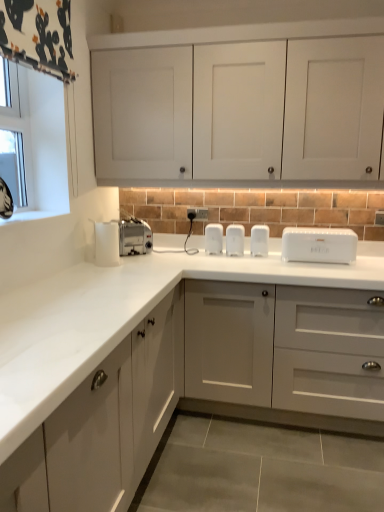
What is the approximate height of matte white cabinet at center, which appears as the first cabinetry when ordered from the bottom?

It is 36.23 inches.

Describe the element at coordinates (286, 349) in the screenshot. The image size is (384, 512). I see `matte white cabinet at center, which appears as the first cabinetry when ordered from the bottom` at that location.

Identify the location of white plastic electric outlet at center. This screenshot has width=384, height=512. (197, 214).

You are a GUI agent. You are given a task and a screenshot of the screen. Output one action in this format:
    pyautogui.click(x=<x>, y=<y>)
    Task: Click on the white matte cabinet doors at upper center, positioned as the 2th cabinetry in bottom-to-top order
    This screenshot has width=384, height=512.
    Given the screenshot: What is the action you would take?
    pyautogui.click(x=238, y=34)

The image size is (384, 512). I want to click on white plastic toaster at center, arranged as the 3th appliance when viewed from the left, so click(235, 240).

What are the coordinates of `matte white cabinet at center, which appears as the first cabinetry when ordered from the bottom` in the screenshot? It's located at (286, 349).

Is point (125, 233) closer to viewer compared to point (253, 250)?

No, (125, 233) is behind (253, 250).

From the picture: How different are the orientations of satin silver toaster at left, which is the 1th appliance in left-to-right order, and white plastic toaster at center, the 4th appliance from the left, in degrees?

86.1 degrees separate the facing orientations of satin silver toaster at left, which is the 1th appliance in left-to-right order, and white plastic toaster at center, the 4th appliance from the left.

Image resolution: width=384 pixels, height=512 pixels. I want to click on appliance that is in front of the white plastic toaster at center, which is the 1th appliance from right to left, so click(133, 234).

Is satin silver toaster at left, which appears as the 4th appliance when viewed from the right, not within white plastic toaster at center, which is the 1th appliance from right to left?

That's correct, satin silver toaster at left, which appears as the 4th appliance when viewed from the right, is outside of white plastic toaster at center, which is the 1th appliance from right to left.

The width and height of the screenshot is (384, 512). I want to click on window sill to the left of silver metallic toaster at center, so click(30, 216).

Between point (22, 213) and point (140, 245), which one is positioned behind?

Point (140, 245)

Between white glossy window sill at upper left and silver metallic toaster at center, which one is positioned behind?

Answer: silver metallic toaster at center.

Do you think white glossy window sill at upper left is within silver metallic toaster at center, or outside of it?

The correct answer is: outside.

Identify the location of window sill above the white plastic toaster at center, which is the 1th appliance from right to left (from the image's perspective). The height and width of the screenshot is (512, 384). (30, 216).

From the image's perspective, relative to white glossy window sill at upper left, is white plastic toaster at center, the 4th appliance from the left, above or below?

Clearly, from the image's perspective, white plastic toaster at center, the 4th appliance from the left, is below white glossy window sill at upper left.

Which of these two, white plastic toaster at center, the 4th appliance from the left, or white glossy window sill at upper left, stands shorter?

Standing shorter between the two is white glossy window sill at upper left.

Is white plastic toaster at center, the 4th appliance from the left, turned away from white glossy window sill at upper left?

No, white plastic toaster at center, the 4th appliance from the left,'s orientation is not away from white glossy window sill at upper left.

Which object is positioned more to the right, silver metallic toaster at center or white plastic toaster at center, which is counted as the 2th appliance, starting from the right?

white plastic toaster at center, which is counted as the 2th appliance, starting from the right, is more to the right.

Are silver metallic toaster at center and white plastic toaster at center, arranged as the 3th appliance when viewed from the left, located far from each other?

Actually, silver metallic toaster at center and white plastic toaster at center, arranged as the 3th appliance when viewed from the left, are a little close together.

From the image's perspective, who appears lower, silver metallic toaster at center or white plastic toaster at center, which is counted as the 2th appliance, starting from the right?

white plastic toaster at center, which is counted as the 2th appliance, starting from the right, from the image's perspective.

From a real-world perspective, does silver metallic toaster at center stand above white plastic toaster at center, arranged as the 3th appliance when viewed from the left?

Yes, from a real-world perspective, silver metallic toaster at center is on top of white plastic toaster at center, arranged as the 3th appliance when viewed from the left.

Measure the distance from silver metallic toaster at center to white glossy window sill at upper left.

A distance of 53.25 centimeters exists between silver metallic toaster at center and white glossy window sill at upper left.

Between silver metallic toaster at center and white glossy window sill at upper left, which one has smaller size?

With smaller size is white glossy window sill at upper left.

From a real-world perspective, which is physically below, silver metallic toaster at center or white glossy window sill at upper left?

silver metallic toaster at center, from a real-world perspective.

Is silver metallic toaster at center facing away from white plastic bread bin at center?

silver metallic toaster at center is not turned away from white plastic bread bin at center.

Does silver metallic toaster at center have a greater height compared to white plastic bread bin at center?

Yes.

Which object is thinner, silver metallic toaster at center or white plastic bread bin at center?

silver metallic toaster at center is thinner.

Is silver metallic toaster at center with white plastic bread bin at center?

silver metallic toaster at center and white plastic bread bin at center are clearly separated.

From the image's perspective, relative to white plastic toaster at center, which is the 1th appliance from right to left, is white matte cabinet doors at upper center, marked as the 1th cabinetry in a top-to-bottom arrangement, above or below?

white matte cabinet doors at upper center, marked as the 1th cabinetry in a top-to-bottom arrangement, is above white plastic toaster at center, which is the 1th appliance from right to left.

Considering the relative sizes of white matte cabinet doors at upper center, marked as the 1th cabinetry in a top-to-bottom arrangement, and white plastic toaster at center, which is the 1th appliance from right to left, in the image provided, is white matte cabinet doors at upper center, marked as the 1th cabinetry in a top-to-bottom arrangement, taller than white plastic toaster at center, which is the 1th appliance from right to left,?

Indeed, white matte cabinet doors at upper center, marked as the 1th cabinetry in a top-to-bottom arrangement, has a greater height compared to white plastic toaster at center, which is the 1th appliance from right to left.

Is white matte cabinet doors at upper center, positioned as the 2th cabinetry in bottom-to-top order, turned away from white plastic toaster at center, which is the 1th appliance from right to left?

No.

Starting from the satin silver toaster at left, which appears as the 4th appliance when viewed from the right, which appliance is the 1st one behind? Please provide its 2D coordinates.

[(259, 240)]

Where is `toaster beneath the white glossy window sill at upper left (from a real-world perspective)`? This screenshot has width=384, height=512. toaster beneath the white glossy window sill at upper left (from a real-world perspective) is located at coordinates (134, 237).

Which object lies nearer to the anchor point silver metallic toaster at center, white plastic toaster at center, the 4th appliance from the left, or satin silver toaster at left, which appears as the 4th appliance when viewed from the right?

satin silver toaster at left, which appears as the 4th appliance when viewed from the right.

Estimate the real-world distances between objects in this image. Which object is closer to matte white cabinet at center, acting as the 2th cabinetry starting from the top, white plastic bread bin at center or silver metallic toaster at center?

The object closer to matte white cabinet at center, acting as the 2th cabinetry starting from the top, is white plastic bread bin at center.

Estimate the real-world distances between objects in this image. Which object is closer to silver metallic toaster at center, white plastic electric outlet at center or white glossy window sill at upper left?

Based on the image, white plastic electric outlet at center appears to be nearer to silver metallic toaster at center.

Estimate the real-world distances between objects in this image. Which object is further from white plastic toaster at center, the 2th appliance positioned from the left, white glossy window sill at upper left or matte white cabinet at center, acting as the 2th cabinetry starting from the top?

white glossy window sill at upper left is positioned further to the anchor white plastic toaster at center, the 2th appliance positioned from the left.

Looking at this image, which object lies nearer to the anchor point white plastic toaster at center, arranged as the 3th appliance when viewed from the left, silver metallic toaster at center or white matte cabinet doors at upper center, positioned as the 2th cabinetry in bottom-to-top order?

silver metallic toaster at center is positioned closer to the anchor white plastic toaster at center, arranged as the 3th appliance when viewed from the left.

Considering their positions, is white plastic bread bin at center positioned closer to white glossy window sill at upper left than matte white cabinet at center, acting as the 2th cabinetry starting from the top?

matte white cabinet at center, acting as the 2th cabinetry starting from the top.

From the picture: Considering their positions, is white plastic toaster at center, which is counted as the 2th appliance, starting from the right, positioned closer to clear glass window at upper left than silver metallic toaster at center?

silver metallic toaster at center.

Looking at the image, which one is located closer to clear glass window at upper left, white plastic toaster at center, the 4th appliance from the left, or white plastic toaster at center, which is the third appliance in right-to-left order?

Among the two, white plastic toaster at center, which is the third appliance in right-to-left order, is located nearer to clear glass window at upper left.

Locate an element on the screen. Image resolution: width=384 pixels, height=512 pixels. toaster positioned between white matte cabinet doors at upper center, positioned as the 2th cabinetry in bottom-to-top order, and white plastic electric outlet at center from near to far is located at coordinates (134, 237).

Identify the location of cabinetry between white glossy window sill at upper left and white plastic toaster at center, which is the 1th appliance from right to left, in the horizontal direction. tap(238, 34).

This screenshot has width=384, height=512. Identify the location of appliance between satin silver toaster at left, which appears as the 4th appliance when viewed from the right, and white plastic toaster at center, arranged as the 3th appliance when viewed from the left, from left to right. (213, 239).

I want to click on electric outlet between satin silver toaster at left, which is the 1th appliance in left-to-right order, and white plastic bread bin at center, in the horizontal direction, so click(x=197, y=214).